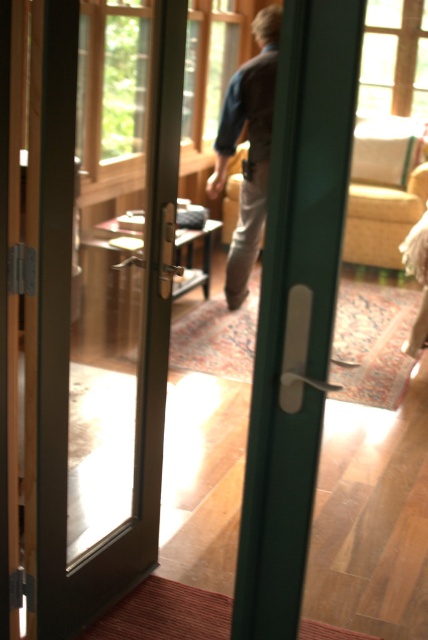
You are standing in a hallway and see the matte glass door at center and the khaki cotton pants at center. Which object is closer to you?

The matte glass door at center is closer to you because it is in front of the khaki cotton pants at center.

You are trying to determine which object is bigger between the matte glass door at center and the khaki cotton pants at center. Based on the scene description, which one is larger?

The matte glass door at center has a larger size compared to the khaki cotton pants at center, so the matte glass door at center is larger.

You are standing outside the glass door and want to enter the living room. There are two points marked on the door. One is at point [85,298] and the other at point [255,193]. Which point is closer to you as you face the door?

Point [85,298] is closer to you because it is in front of point [255,193].